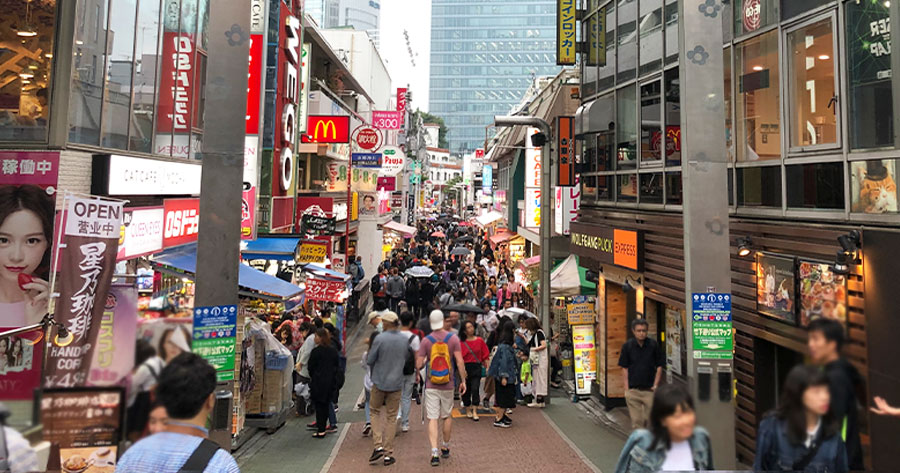
Image resolution: width=900 pixels, height=473 pixels. In order to click on wall in this screenshot , I will do `click(657, 248)`.